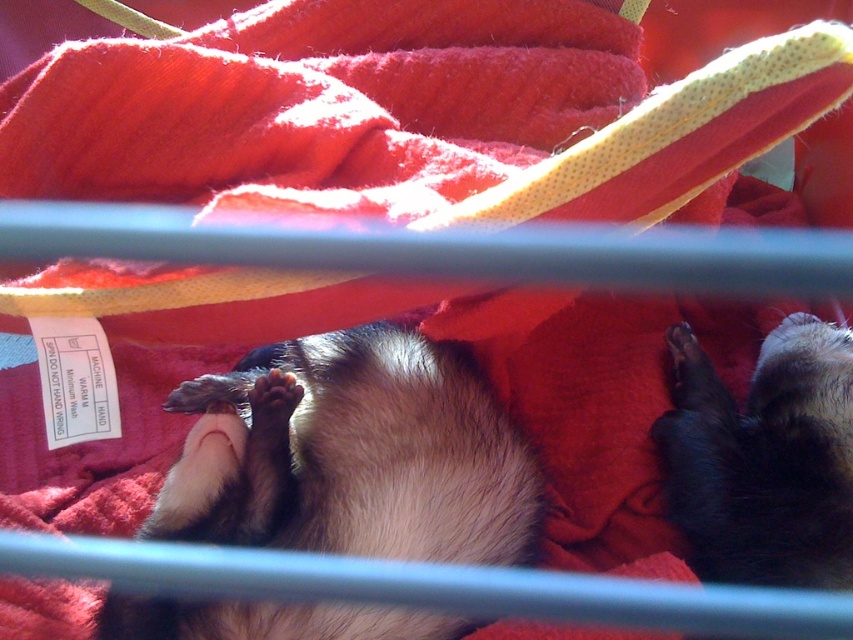
You are a veterinarian examining an animal carrier. You see a fuzzy fur animal at center and a black fur animal at lower right. Which animal is positioned closer to the front of the carrier?

The fuzzy fur animal at center is closer to the viewer than the black fur animal at lower right, so the fuzzy fur animal at center is positioned closer to the front of the carrier.

You are a photographer trying to capture a close shot of the ferret in the pet carrier. You want to focus on the point closer to the camera between point (375, 540) and point (743, 493). Which point should you choose?

Point (375, 540) is closer to the camera than point (743, 493), so you should choose point (375, 540) to focus on for a clearer close shot.

You are a veterinarian examining an animal in a carrier. You notice a point at coordinates (358, 454). Based on the image, where is this point located?

The point at (358, 454) is located on the fuzzy fur animal at center.